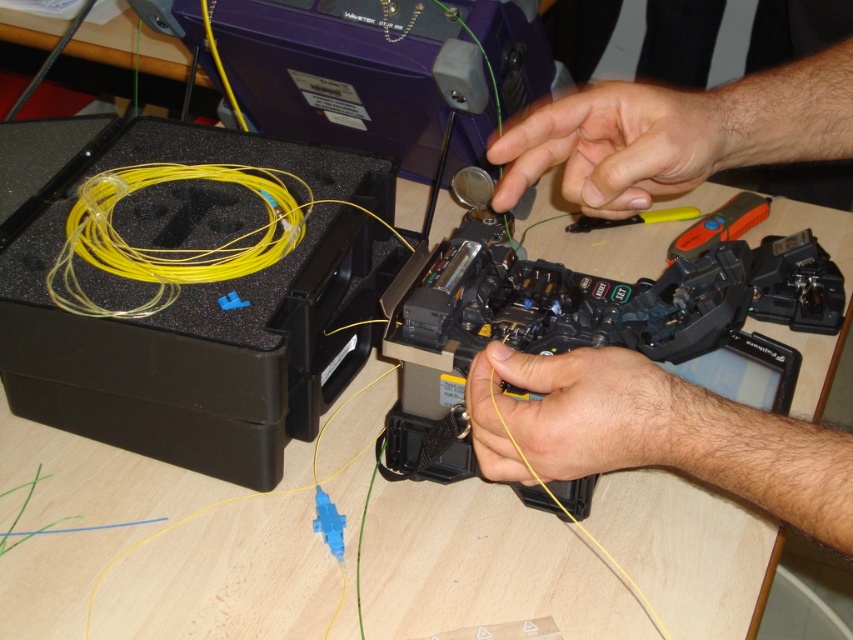
Which is in front, point (581, 355) or point (581, 397)?

Positioned in front is point (581, 397).

Between point (781, 156) and point (750, 429), which one is positioned in front?

Point (750, 429)

The height and width of the screenshot is (640, 853). I want to click on smooth yellow wire at center, so click(654, 435).

Is yellow matte wire at center below orange plastic tool at center?

Indeed, yellow matte wire at center is positioned under orange plastic tool at center.

Between yellow matte wire at center and orange plastic tool at center, which one is positioned higher?

orange plastic tool at center is above.

Is point (641, 417) closer to viewer compared to point (735, 198)?

Yes, it is.

Locate an element on the screen. Image resolution: width=853 pixels, height=640 pixels. yellow matte wire at center is located at coordinates (579, 413).

Is smooth yellow wire at center above orange plastic tool at center?

No, smooth yellow wire at center is not above orange plastic tool at center.

Between smooth yellow wire at center and orange plastic tool at center, which one appears on the left side from the viewer's perspective?

Positioned to the left is smooth yellow wire at center.

Is point (805, 122) in front of point (737, 225)?

Yes.

The height and width of the screenshot is (640, 853). I want to click on smooth yellow wire at center, so click(x=654, y=435).